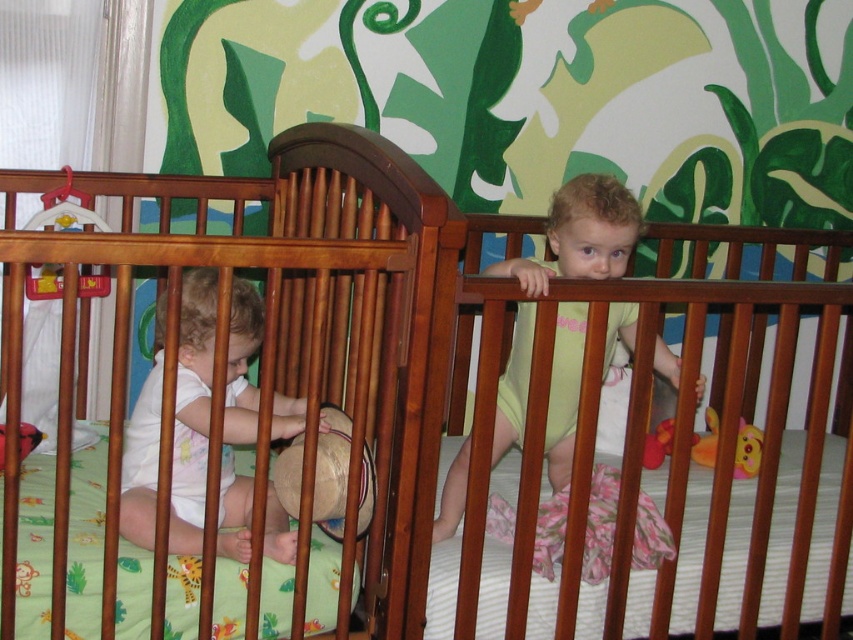
Between white cotton toddler at left and rubber duck at center, which one is positioned higher?

white cotton toddler at left is higher up.

Does white cotton toddler at left appear over rubber duck at center?

Correct, white cotton toddler at left is located above rubber duck at center.

Is point (234, 419) closer to camera compared to point (646, 451)?

Yes, point (234, 419) is in front of point (646, 451).

The height and width of the screenshot is (640, 853). I want to click on white cotton toddler at left, so click(x=192, y=410).

Does yellow plush duck at center have a smaller size compared to rubber duck at center?

No, yellow plush duck at center is not smaller than rubber duck at center.

Who is positioned more to the right, yellow plush duck at center or rubber duck at center?

Positioned to the right is yellow plush duck at center.

Which is behind, point (741, 438) or point (646, 445)?

Positioned behind is point (741, 438).

At what (x,y) coordinates should I click in order to perform the action: click on yellow plush duck at center. Please return your answer as a coordinate pair (x, y). Image resolution: width=853 pixels, height=640 pixels. Looking at the image, I should click on (747, 451).

Is white cotton toddler at left further to the viewer compared to light yellow fabric toddler at upper right?

No, it is not.

Is point (177, 512) behind point (500, 381)?

No, it is in front of (500, 381).

Where is `white cotton toddler at left`? This screenshot has height=640, width=853. white cotton toddler at left is located at coordinates (192, 410).